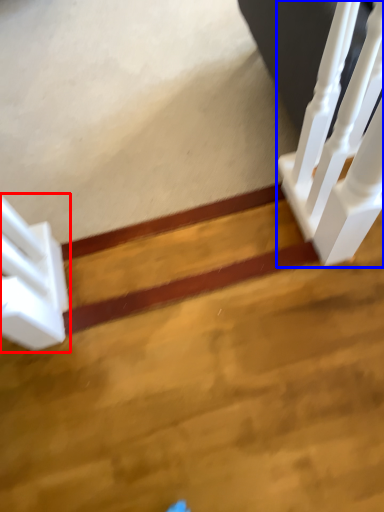
Question: Which of the following is the closest to the observer, stairs (highlighted by a red box) or stairwell (highlighted by a blue box)?

Choices:
 (A) stairs
 (B) stairwell

Answer: (B)